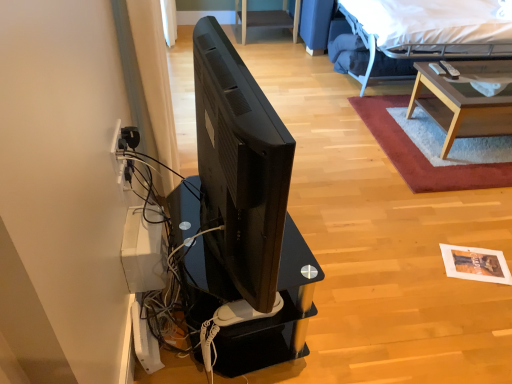
Question: Could you tell me if light brown wooden table at upper right is facing white fabric bed at upper right?

Choices:
 (A) no
 (B) yes

Answer: (A)

Question: Can you confirm if light brown wooden table at upper right is thinner than white fabric bed at upper right?

Choices:
 (A) yes
 (B) no

Answer: (A)

Question: From a real-world perspective, is light brown wooden table at upper right over white fabric bed at upper right?

Choices:
 (A) no
 (B) yes

Answer: (A)

Question: Is light brown wooden table at upper right next to white fabric bed at upper right?

Choices:
 (A) yes
 (B) no

Answer: (B)

Question: Considering the relative positions of light brown wooden table at upper right and white fabric bed at upper right in the image provided, is light brown wooden table at upper right in front of white fabric bed at upper right?

Choices:
 (A) yes
 (B) no

Answer: (A)

Question: Is light brown wooden table at upper right far away from white fabric bed at upper right?

Choices:
 (A) yes
 (B) no

Answer: (B)

Question: Considering the relative sizes of black matte television at center and shaggy red rug at upper right in the image provided, is black matte television at center thinner than shaggy red rug at upper right?

Choices:
 (A) no
 (B) yes

Answer: (B)

Question: Can you confirm if black matte television at center is shorter than shaggy red rug at upper right?

Choices:
 (A) no
 (B) yes

Answer: (A)

Question: Does black matte television at center have a greater width compared to shaggy red rug at upper right?

Choices:
 (A) yes
 (B) no

Answer: (B)

Question: From the image's perspective, is black matte television at center above shaggy red rug at upper right?

Choices:
 (A) no
 (B) yes

Answer: (A)

Question: From a real-world perspective, is black matte television at center located higher than shaggy red rug at upper right?

Choices:
 (A) no
 (B) yes

Answer: (B)

Question: From a real-world perspective, is black matte television at center physically below shaggy red rug at upper right?

Choices:
 (A) yes
 (B) no

Answer: (B)

Question: From the image's perspective, does light brown wooden table at upper right appear lower than black matte television at center?

Choices:
 (A) no
 (B) yes

Answer: (A)